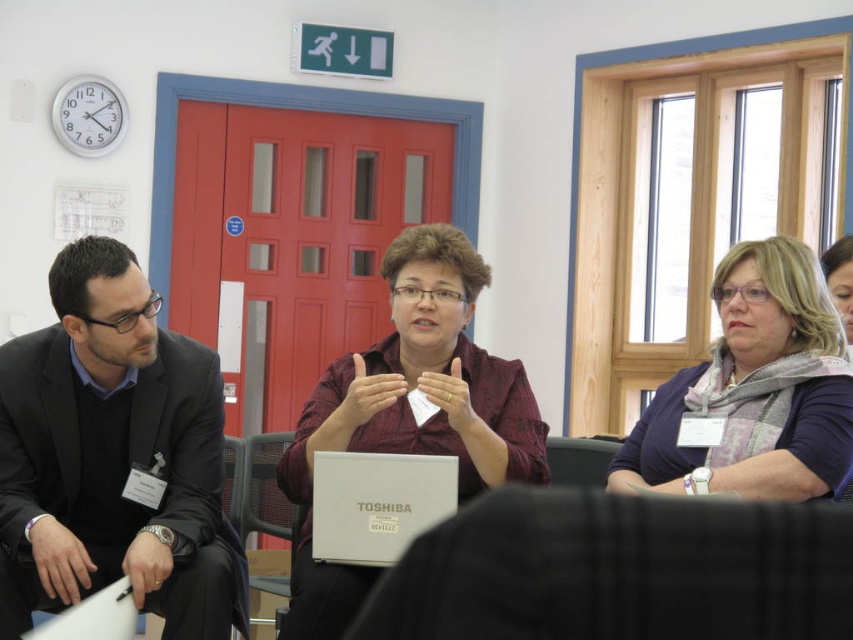
You are a photographer in the room and want to capture a photo that includes both the light brown scarf at right and the matte purple scarf at upper right. Which scarf should you position closer to the bottom of the frame to ensure both are fully visible?

The light brown scarf at right is taller than the matte purple scarf at upper right, so to ensure both are fully visible, position the taller light brown scarf at right closer to the bottom of the frame.

You are attending a meeting in a conference room and need to sit down. There is a black fabric chair at lower center and a light brown scarf at right. Which object is located to the left of the other?

The black fabric chair at lower center is positioned on the left side of light brown scarf at right.

You are an attendee at this meeting and need to locate the white plastic laptop at lower left. Can you see it from your current position, given that the light brown scarf at right is blocking your view?

The light brown scarf at right is located above the white plastic laptop at lower left, so you should be able to see the white plastic laptop at lower left as it is not directly blocked by the scarf.